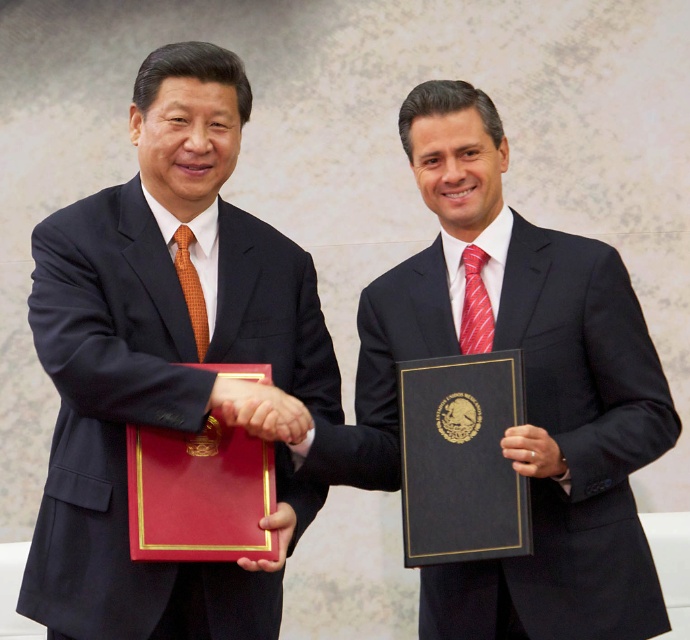
Is point (560, 497) positioned before point (464, 259)?

Yes, point (560, 497) is in front of point (464, 259).

Who is lower down, black satin suit at center or red striped tie at center?

black satin suit at center is lower down.

Which is behind, point (464, 566) or point (463, 304)?

Positioned behind is point (463, 304).

Find the location of a particular element. The image size is (690, 640). black satin suit at center is located at coordinates (571, 452).

Who is higher up, matte black suit at center or matte red folder at center?

Positioned higher is matte black suit at center.

The width and height of the screenshot is (690, 640). What are the coordinates of `matte black suit at center` in the screenshot? It's located at (x=159, y=355).

Is point (63, 552) positioned before point (276, 518)?

Yes, point (63, 552) is closer to viewer.

Identify the location of matte black suit at center. (159, 355).

Consider the image. Does black satin suit at center appear on the right side of matte black hand at center?

In fact, black satin suit at center is to the left of matte black hand at center.

Which of these two, black satin suit at center or matte black hand at center, stands taller?

Standing taller between the two is black satin suit at center.

You are a GUI agent. You are given a task and a screenshot of the screen. Output one action in this format:
    pyautogui.click(x=<x>, y=<y>)
    Task: Click on the black satin suit at center
    This screenshot has width=690, height=640.
    Given the screenshot: What is the action you would take?
    pyautogui.click(x=571, y=452)